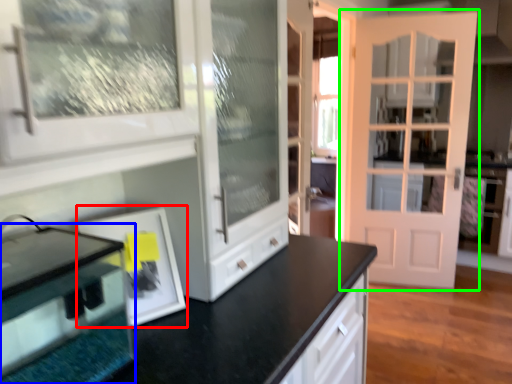
Question: Which object is the closest to the picture frame (highlighted by a red box)? Choose among these: appliance (highlighted by a blue box) or door (highlighted by a green box).

Choices:
 (A) appliance
 (B) door

Answer: (A)